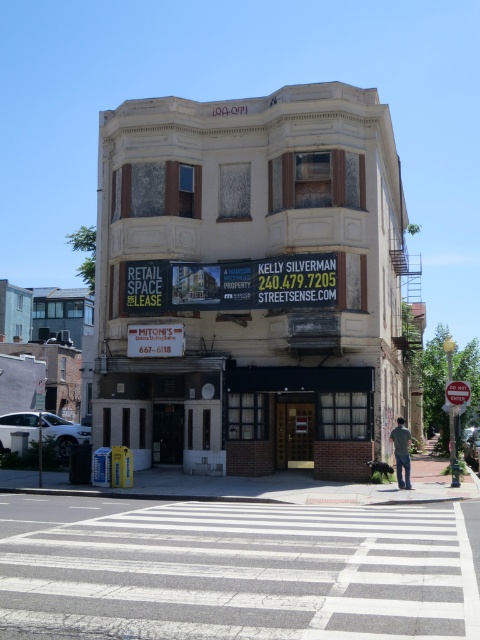
Question: Observing the image, what is the correct spatial positioning of gray asphalt crosswalk at lower center in reference to brushed metal stop sign at center?

Choices:
 (A) left
 (B) right

Answer: (A)

Question: Which of these objects is positioned closest to the gray asphalt crosswalk at lower center?

Choices:
 (A) gray cotton shirt at lower right
 (B) white brick building at center

Answer: (A)

Question: Which point is closer to the camera?

Choices:
 (A) gray asphalt crosswalk at lower center
 (B) gray cotton shirt at lower right
 (C) brushed metal stop sign at center

Answer: (A)

Question: In this image, where is gray asphalt crosswalk at lower center located relative to brushed metal stop sign at center?

Choices:
 (A) left
 (B) right

Answer: (A)

Question: Which object is the farthest from the white brick building at center?

Choices:
 (A) gray asphalt crosswalk at lower center
 (B) gray cotton shirt at lower right
 (C) brushed metal stop sign at center

Answer: (A)

Question: Is gray asphalt crosswalk at lower center to the right of gray cotton shirt at lower right from the viewer's perspective?

Choices:
 (A) yes
 (B) no

Answer: (B)